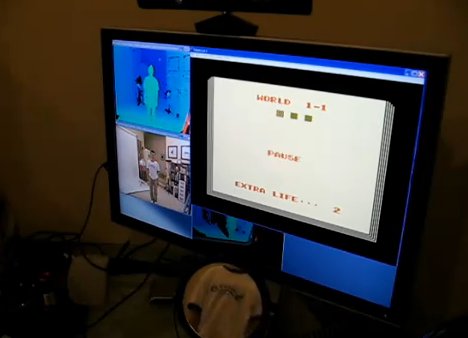
Image resolution: width=468 pixels, height=338 pixels. I want to click on top left hand corner of computer monitor, so click(102, 31).